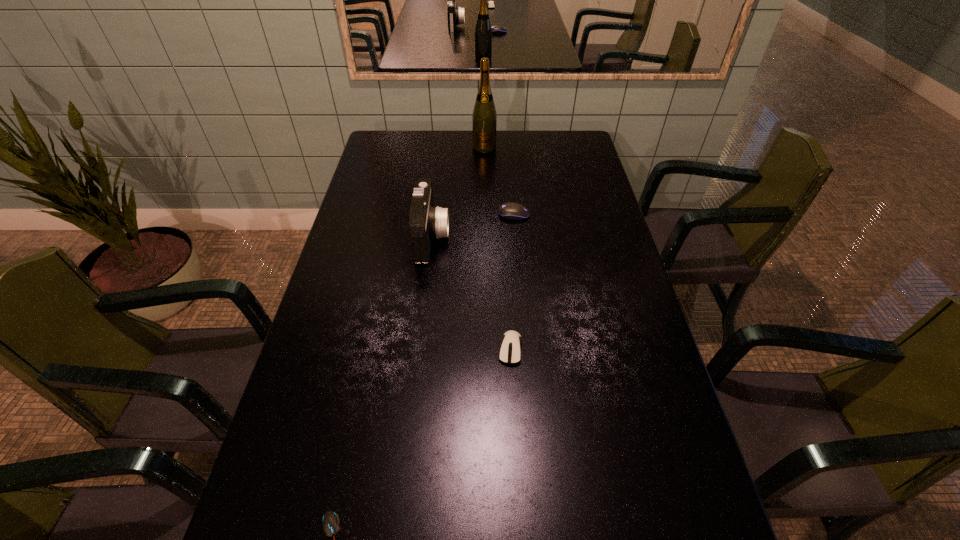
The image size is (960, 540). Identify the location of the third closest object to the camcorder. (484, 119).

The image size is (960, 540). I want to click on mouse object that ranks as the closest to the shortest mouse, so click(x=510, y=348).

Choose which mouse is the second nearest neighbor to the second nearest mouse. Please provide its 2D coordinates. Your answer should be formatted as a tuple, i.e. [(x, y)], where the tuple contains the x and y coordinates of a point satisfying the conditions above.

[(513, 211)]

You are a GUI agent. You are given a task and a screenshot of the screen. Output one action in this format:
    pyautogui.click(x=<x>, y=<y>)
    Task: Click on the free spot that satisfies the following two spatial constraints: 1. on the front-facing side of the second nearest mouse; 2. on the right side of the farthest object
    
    Given the screenshot: What is the action you would take?
    pyautogui.click(x=487, y=349)

Identify the location of free location that satisfies the following two spatial constraints: 1. on the lens of the second object from left to right; 2. on the right side of the second nearest object. 419,349.

You are a GUI agent. You are given a task and a screenshot of the screen. Output one action in this format:
    pyautogui.click(x=<x>, y=<y>)
    Task: Click on the free spot that satisfies the following two spatial constraints: 1. on the front-facing side of the wine bottle; 2. on the lens of the camcorder
    Image resolution: width=960 pixels, height=540 pixels.
    Given the screenshot: What is the action you would take?
    pyautogui.click(x=486, y=237)